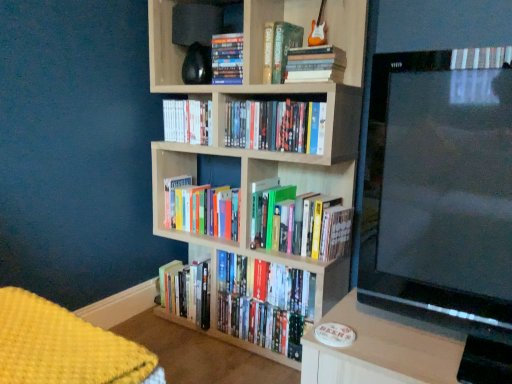
Describe the element at coordinates (276, 125) in the screenshot. I see `hardcover books at center, which is the fourth book in bottom-to-top order` at that location.

At what (x,y) coordinates should I click in order to perform the action: click on hardcover book at center, the 5th book when ordered from bottom to top. Please return your answer as a coordinate pair (x, y). This screenshot has height=384, width=512. Looking at the image, I should click on (188, 121).

This screenshot has width=512, height=384. I want to click on matte black shelf at upper center, so click(166, 51).

The height and width of the screenshot is (384, 512). I want to click on hardcover books at center, arranged as the fifth book when viewed from the top, so click(x=276, y=125).

Based on the photo, is hardcover book at center, which is counted as the 1th book, starting from the top, looking in the opposite direction of hardcover books at center, which appears as the 2th book when ordered from the bottom?

No.

Which is correct: hardcover book at center, which is counted as the 1th book, starting from the top, is inside hardcover books at center, which appears as the 2th book when ordered from the bottom, or outside of it?

hardcover book at center, which is counted as the 1th book, starting from the top, is outside hardcover books at center, which appears as the 2th book when ordered from the bottom.

In the image, is hardcover book at center, which is counted as the 1th book, starting from the top, positioned in front of or behind hardcover books at center, which ranks as the 7th book in top-to-bottom order?

hardcover book at center, which is counted as the 1th book, starting from the top, is positioned farther from the viewer than hardcover books at center, which ranks as the 7th book in top-to-bottom order.

Who is shorter, hardcover book at center, the 8th book positioned from the bottom, or hardcover books at center, which ranks as the 7th book in top-to-bottom order?

hardcover book at center, the 8th book positioned from the bottom, is shorter.

Is black glossy tv at right facing towards hardcover books at center, marked as the 3th book in a bottom-to-top arrangement?

No, black glossy tv at right is not aimed at hardcover books at center, marked as the 3th book in a bottom-to-top arrangement.

Is black glossy tv at right located outside hardcover books at center, the sixth book from the top?

Yes, black glossy tv at right is outside of hardcover books at center, the sixth book from the top.

From the image's perspective, between black glossy tv at right and hardcover books at center, the sixth book from the top, who is located below?

hardcover books at center, the sixth book from the top, is shown below in the image.

Which of these two, black glossy tv at right or hardcover books at center, the sixth book from the top, is bigger?

black glossy tv at right.

Is hardcover books at center, placed as the first book when sorted from bottom to top, facing towards black glossy tv at right?

No, hardcover books at center, placed as the first book when sorted from bottom to top, is not oriented towards black glossy tv at right.

In the image, is hardcover books at center, placed as the first book when sorted from bottom to top, positioned in front of or behind black glossy tv at right?

hardcover books at center, placed as the first book when sorted from bottom to top, is behind black glossy tv at right.

Which object is positioned more to the left, hardcover books at center, which is the eighth book in top-to-bottom order, or black glossy tv at right?

hardcover books at center, which is the eighth book in top-to-bottom order.

What's the angular difference between hardcover books at center, which is the eighth book in top-to-bottom order, and black glossy tv at right's facing directions?

The angle between the facing direction of hardcover books at center, which is the eighth book in top-to-bottom order, and the facing direction of black glossy tv at right is 2.14 degrees.

Does hardcover books at center, which ranks as the 7th book in top-to-bottom order, contain light wood bookcase at center?

That's incorrect, light wood bookcase at center is not inside hardcover books at center, which ranks as the 7th book in top-to-bottom order.

Can you confirm if hardcover books at center, which appears as the 2th book when ordered from the bottom, is thinner than light wood bookcase at center?

Indeed, hardcover books at center, which appears as the 2th book when ordered from the bottom, has a lesser width compared to light wood bookcase at center.

Which object is closer to the camera taking this photo, hardcover books at center, which appears as the 2th book when ordered from the bottom, or light wood bookcase at center?

light wood bookcase at center.

Considering the sizes of objects black glossy tv at right and light wood bookcase at center in the image provided, who is smaller, black glossy tv at right or light wood bookcase at center?

Smaller between the two is black glossy tv at right.

Is black glossy tv at right touching light wood bookcase at center?

No, black glossy tv at right is not next to light wood bookcase at center.

From the image's perspective, which is above, black glossy tv at right or light wood bookcase at center?

light wood bookcase at center, from the image's perspective.

From a real-world perspective, who is located higher, black glossy tv at right or light wood bookcase at center?

black glossy tv at right.

From a real-world perspective, between hardcover book at upper center, the 3th book in the top-to-bottom sequence, and hardcover books at center, which appears as the 2th book when ordered from the bottom, who is vertically higher?

From a 3D spatial view, hardcover book at upper center, the 3th book in the top-to-bottom sequence, is above.

From a real-world perspective, which book is the 3rd one underneath the hardcover book at upper center, the sixth book when ordered from bottom to top? Please provide its 2D coordinates.

[(306, 224)]

Is hardcover books at center, which ranks as the 7th book in top-to-bottom order, located outside hardcover books at upper center, the seventh book from the bottom?

Yes, hardcover books at center, which ranks as the 7th book in top-to-bottom order, is not within hardcover books at upper center, the seventh book from the bottom.

Is hardcover books at center, which appears as the 2th book when ordered from the bottom, taller or shorter than hardcover books at upper center, the seventh book from the bottom?

hardcover books at center, which appears as the 2th book when ordered from the bottom, is taller than hardcover books at upper center, the seventh book from the bottom.

From a real-world perspective, is hardcover books at center, which ranks as the 7th book in top-to-bottom order, physically below hardcover books at upper center, which is the 2th book from top to bottom?

Indeed, from a real-world perspective, hardcover books at center, which ranks as the 7th book in top-to-bottom order, is positioned beneath hardcover books at upper center, which is the 2th book from top to bottom.

Which object is positioned more to the left, hardcover books at center, which appears as the 2th book when ordered from the bottom, or hardcover books at upper center, the seventh book from the bottom?

hardcover books at upper center, the seventh book from the bottom.

Where is `book that is the 5th object directly below the hardcover book at center, which is counted as the 1th book, starting from the top (from a real-world perspective)`? book that is the 5th object directly below the hardcover book at center, which is counted as the 1th book, starting from the top (from a real-world perspective) is located at coordinates (306, 224).

The width and height of the screenshot is (512, 384). I want to click on television that is above the hardcover books at center, the sixth book from the top (from the image's perspective), so click(x=439, y=191).

When comparing their distances from yellow knitted blanket at lower left, does hardcover book at upper center, the sixth book when ordered from bottom to top, or hardcover book at center, which is counted as the 1th book, starting from the top, seem closer?

hardcover book at upper center, the sixth book when ordered from bottom to top, lies closer to yellow knitted blanket at lower left than the other object.

Estimate the real-world distances between objects in this image. Which object is further from hardcover books at upper center, the seventh book from the bottom, hardcover books at center, placed as the first book when sorted from bottom to top, or hardcover books at center, arranged as the fifth book when viewed from the top?

The object further to hardcover books at upper center, the seventh book from the bottom, is hardcover books at center, placed as the first book when sorted from bottom to top.

When comparing their distances from hardcover books at center, which ranks as the 7th book in top-to-bottom order, does hardcover books at center, marked as the 3th book in a bottom-to-top arrangement, or yellow knitted blanket at lower left seem closer?

hardcover books at center, marked as the 3th book in a bottom-to-top arrangement, lies closer to hardcover books at center, which ranks as the 7th book in top-to-bottom order, than the other object.

Estimate the real-world distances between objects in this image. Which object is further from hardcover books at center, which ranks as the 7th book in top-to-bottom order, matte black shelf at upper center or hardcover books at center, which is the fourth book in bottom-to-top order?

Among the two, matte black shelf at upper center is located further to hardcover books at center, which ranks as the 7th book in top-to-bottom order.

Looking at this image, estimate the real-world distances between objects in this image. Which object is closer to hardcover book at center, the 5th book when ordered from bottom to top, hardcover books at upper center, which is the 2th book from top to bottom, or yellow knitted blanket at lower left?

Among the two, hardcover books at upper center, which is the 2th book from top to bottom, is located nearer to hardcover book at center, the 5th book when ordered from bottom to top.

From the image, which object appears to be nearer to yellow knitted blanket at lower left, light wood bookcase at center or hardcover books at center, which is the eighth book in top-to-bottom order?

hardcover books at center, which is the eighth book in top-to-bottom order.

From the image, which object appears to be nearer to hardcover books at upper center, the seventh book from the bottom, black glossy tv at right or yellow knitted blanket at lower left?

Based on the image, black glossy tv at right appears to be nearer to hardcover books at upper center, the seventh book from the bottom.

Which object lies further to the anchor point black glossy tv at right, yellow knitted blanket at lower left or hardcover books at center, which ranks as the 7th book in top-to-bottom order?

yellow knitted blanket at lower left is further to black glossy tv at right.

At what (x,y) coordinates should I click in order to perform the action: click on bookcase between black glossy tv at right and hardcover book at center, the 8th book positioned from the bottom, along the z-axis. Please return your answer as a coordinate pair (x, y). Image resolution: width=512 pixels, height=384 pixels. Looking at the image, I should click on (258, 94).

In order to click on bookcase located between black glossy tv at right and hardcover books at center, placed as the first book when sorted from bottom to top, in the depth direction in this screenshot , I will do `click(258, 94)`.

Where is `bookcase located between yellow knitted blanket at lower left and hardcover books at center, which appears as the 2th book when ordered from the bottom, in the depth direction`? bookcase located between yellow knitted blanket at lower left and hardcover books at center, which appears as the 2th book when ordered from the bottom, in the depth direction is located at coordinates (258, 94).

Where is `bookcase between hardcover book at center, the 5th book when ordered from bottom to top, and hardcover book at upper center, the 3th book in the top-to-bottom sequence`? The image size is (512, 384). bookcase between hardcover book at center, the 5th book when ordered from bottom to top, and hardcover book at upper center, the 3th book in the top-to-bottom sequence is located at coordinates pyautogui.click(x=258, y=94).